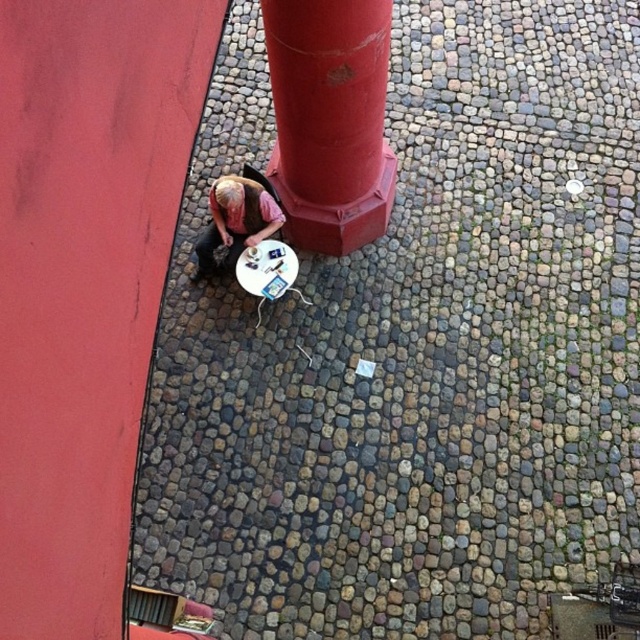
You are standing on the cobblestone street and want to take a photo of the smooth red pillar at center and the matte pink shirt at center. Which object should you focus on first if you want to include both in the frame without moving the camera?

You should focus on the smooth red pillar at center first because it is taller than the matte pink shirt at center, so it will occupy more space in the frame and ensure both are visible.

You are standing on the cobblestone street and see the smooth red pillar at center and the matte pink shirt at center. From your perspective, which object is positioned to the left?

The matte pink shirt at center is positioned to the left of the smooth red pillar at center.